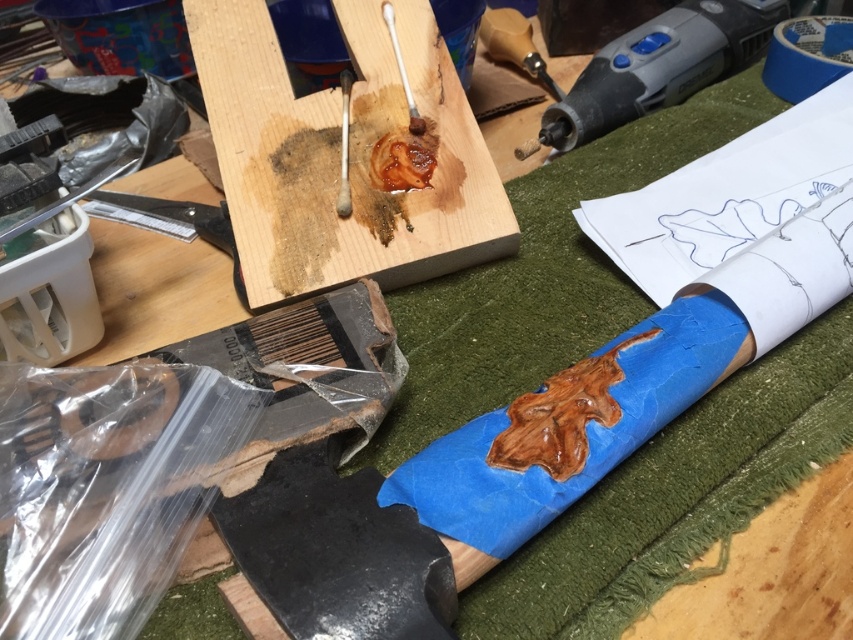
Question: Which object is closer to the camera taking this photo?

Choices:
 (A) wooden plank at center
 (B) matte gray power tool at upper right
 (C) wooden stick at upper center

Answer: (A)

Question: Is matte gray power tool at upper right above wooden stick at upper center?

Choices:
 (A) yes
 (B) no

Answer: (A)

Question: Where is wooden plank at center located in relation to matte gray power tool at upper right in the image?

Choices:
 (A) below
 (B) above

Answer: (A)

Question: Is wooden plank at center above wooden stick at upper center?

Choices:
 (A) no
 (B) yes

Answer: (A)

Question: Among these objects, which one is farthest from the camera?

Choices:
 (A) wooden plank at center
 (B) wooden stick at upper center
 (C) matte gray power tool at upper right

Answer: (C)

Question: Which of the following is the farthest from the observer?

Choices:
 (A) (469, 218)
 (B) (558, 115)

Answer: (B)